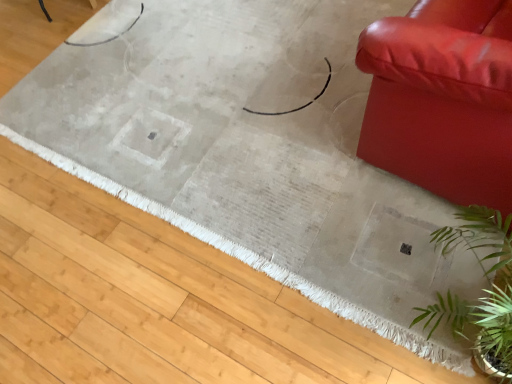
Describe the element at coordinates (442, 99) in the screenshot. I see `shiny leather couch at right` at that location.

You are a GUI agent. You are given a task and a screenshot of the screen. Output one action in this format:
    pyautogui.click(x=<x>, y=<y>)
    Task: Click on the green leafy plant at lower right
    The image size is (512, 384).
    Given the screenshot: What is the action you would take?
    pyautogui.click(x=483, y=289)

Where is `shiny leather couch at right`? This screenshot has height=384, width=512. shiny leather couch at right is located at coordinates (442, 99).

Is green leafy plant at lower right in contact with shiny leather couch at right?

No, green leafy plant at lower right is not touching shiny leather couch at right.

Relative to shiny leather couch at right, is green leafy plant at lower right in front or behind?

Visually, green leafy plant at lower right is located in front of shiny leather couch at right.

What's the angular difference between green leafy plant at lower right and shiny leather couch at right's facing directions?

10.3 degrees.

Is green leafy plant at lower right taller or shorter than shiny leather couch at right?

Clearly, green leafy plant at lower right is shorter compared to shiny leather couch at right.

From the image's perspective, which object appears higher, green leafy plant at lower right or beige woven rug at center?

From the image's view, beige woven rug at center is above.

Is green leafy plant at lower right bigger than beige woven rug at center?

Incorrect, green leafy plant at lower right is not larger than beige woven rug at center.

Is green leafy plant at lower right placed right next to beige woven rug at center?

No, green leafy plant at lower right is not next to beige woven rug at center.

Which point is more distant from viewer, (490, 245) or (38, 353)?

Positioned behind is point (490, 245).

Is beige woven rug at center facing towards shiny leather couch at right?

No, beige woven rug at center is not facing towards shiny leather couch at right.

In order to click on doormat lying below the shiny leather couch at right (from the image's perspective) in this screenshot , I will do `click(157, 300)`.

Does beige woven rug at center have a larger size compared to shiny leather couch at right?

Yes, beige woven rug at center is bigger than shiny leather couch at right.

Which is farther, (400, 78) or (505, 325)?

The point (400, 78) is behind.

Between shiny leather couch at right and green leafy plant at lower right, which one has more height?

With more height is shiny leather couch at right.

Is shiny leather couch at right bigger or smaller than green leafy plant at lower right?

Clearly, shiny leather couch at right is larger in size than green leafy plant at lower right.

From a real-world perspective, who is located higher, shiny leather couch at right or green leafy plant at lower right?

In real-world perspective, shiny leather couch at right is above.

Image resolution: width=512 pixels, height=384 pixels. I want to click on doormat that appears on the left of green leafy plant at lower right, so click(157, 300).

Is beige woven rug at center situated inside green leafy plant at lower right or outside?

beige woven rug at center is not inside green leafy plant at lower right, it's outside.

Is beige woven rug at center far from green leafy plant at lower right?

No, beige woven rug at center is not far from green leafy plant at lower right.

Considering the relative positions of beige woven rug at center and green leafy plant at lower right in the image provided, is beige woven rug at center in front of green leafy plant at lower right?

No, beige woven rug at center is behind green leafy plant at lower right.

Considering the points (417, 30) and (143, 305), which point is in front, point (417, 30) or point (143, 305)?

Point (417, 30)

Can you confirm if shiny leather couch at right is shorter than beige woven rug at center?

Incorrect, the height of shiny leather couch at right does not fall short of that of beige woven rug at center.

Would you consider shiny leather couch at right to be distant from beige woven rug at center?

shiny leather couch at right is near beige woven rug at center, not far away.

I want to click on houseplant in front of the shiny leather couch at right, so coord(483,289).

Image resolution: width=512 pixels, height=384 pixels. Find the location of `houseplant located below the beige woven rug at center (from the image's perspective)`. houseplant located below the beige woven rug at center (from the image's perspective) is located at coordinates (483, 289).

Estimate the real-world distances between objects in this image. Which object is further from green leafy plant at lower right, beige woven rug at center or shiny leather couch at right?

beige woven rug at center is positioned further to the anchor green leafy plant at lower right.

Looking at the image, which one is located closer to beige woven rug at center, shiny leather couch at right or green leafy plant at lower right?

The object closer to beige woven rug at center is green leafy plant at lower right.

Looking at the image, which one is located further to shiny leather couch at right, green leafy plant at lower right or beige woven rug at center?

Based on the image, beige woven rug at center appears to be further to shiny leather couch at right.

Estimate the real-world distances between objects in this image. Which object is further from green leafy plant at lower right, shiny leather couch at right or beige woven rug at center?

beige woven rug at center is further to green leafy plant at lower right.

Estimate the real-world distances between objects in this image. Which object is further from shiny leather couch at right, beige woven rug at center or green leafy plant at lower right?

Among the two, beige woven rug at center is located further to shiny leather couch at right.

Based on their spatial positions, is green leafy plant at lower right or shiny leather couch at right further from beige woven rug at center?

shiny leather couch at right.

Identify the location of houseplant between beige woven rug at center and shiny leather couch at right. pos(483,289).